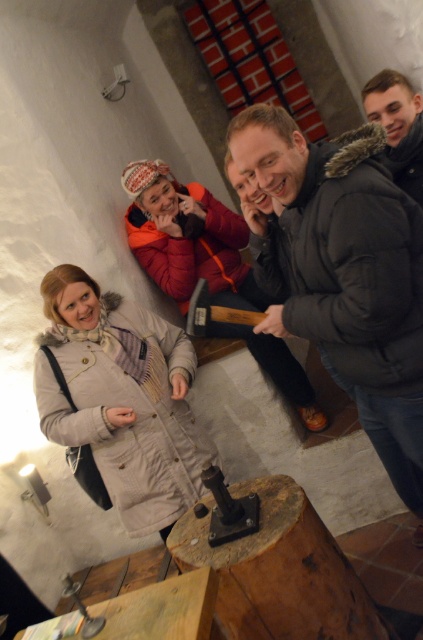
Does point (73, 435) come farther from viewer compared to point (417, 196)?

Yes, point (73, 435) is farther from viewer.

Is the position of beige woolen coat at lower left less distant than that of dark gray fur-lined jacket at upper right?

No, it is not.

Where is `beige woolen coat at lower left`? The width and height of the screenshot is (423, 640). beige woolen coat at lower left is located at coordinates (121, 397).

This screenshot has width=423, height=640. What do you see at coordinates (121, 397) in the screenshot?
I see `beige woolen coat at lower left` at bounding box center [121, 397].

Who is taller, beige woolen coat at lower left or orange fleece jacket at upper center?

With more height is orange fleece jacket at upper center.

Who is more forward, (189,369) or (170,292)?

Positioned in front is point (189,369).

The width and height of the screenshot is (423, 640). What are the coordinates of `beige woolen coat at lower left` in the screenshot? It's located at coord(121,397).

Find the location of `black puffy jacket at upper right`. black puffy jacket at upper right is located at coordinates (343, 273).

Is point (342, 314) farther from viewer compared to point (386, 102)?

No, it is in front of (386, 102).

Find the location of `black puffy jacket at upper right`. black puffy jacket at upper right is located at coordinates (343, 273).